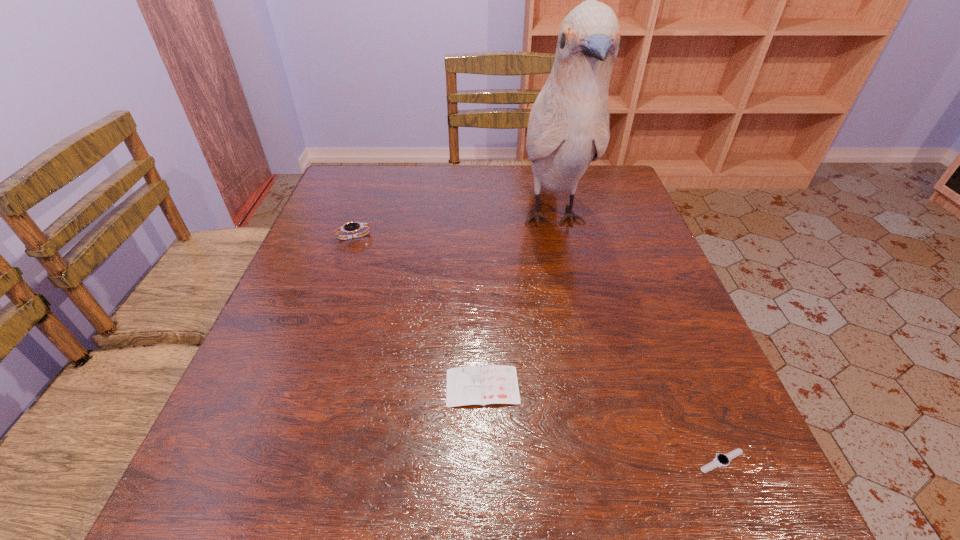
Where is `vacant space at the near edge of the desktop`? This screenshot has width=960, height=540. vacant space at the near edge of the desktop is located at coordinates (436, 500).

Identify the location of free space at the left edge of the desktop. (306, 373).

The width and height of the screenshot is (960, 540). In order to click on free region at the right edge in this screenshot , I will do `click(620, 226)`.

The height and width of the screenshot is (540, 960). I want to click on vacant region at the near left corner, so click(x=256, y=473).

The width and height of the screenshot is (960, 540). In the image, there is a desktop. In order to click on vacant space at the near right corner in this screenshot , I will do `click(765, 496)`.

This screenshot has height=540, width=960. I want to click on vacant region between the rightmost object and the left watch, so click(538, 349).

Locate an element on the screen. free spot between the diary and the right watch is located at coordinates (602, 423).

At what (x,y) coordinates should I click in order to perform the action: click on vacant space that's between the shortest object and the second object from right to left. Please return your answer as a coordinate pair (x, y). The height and width of the screenshot is (540, 960). Looking at the image, I should click on (637, 340).

Where is `unoccupied area between the tallest object and the second shortest object`? Image resolution: width=960 pixels, height=540 pixels. unoccupied area between the tallest object and the second shortest object is located at coordinates (517, 303).

Find the location of `free space between the leftmost object and the diary`. free space between the leftmost object and the diary is located at coordinates (419, 312).